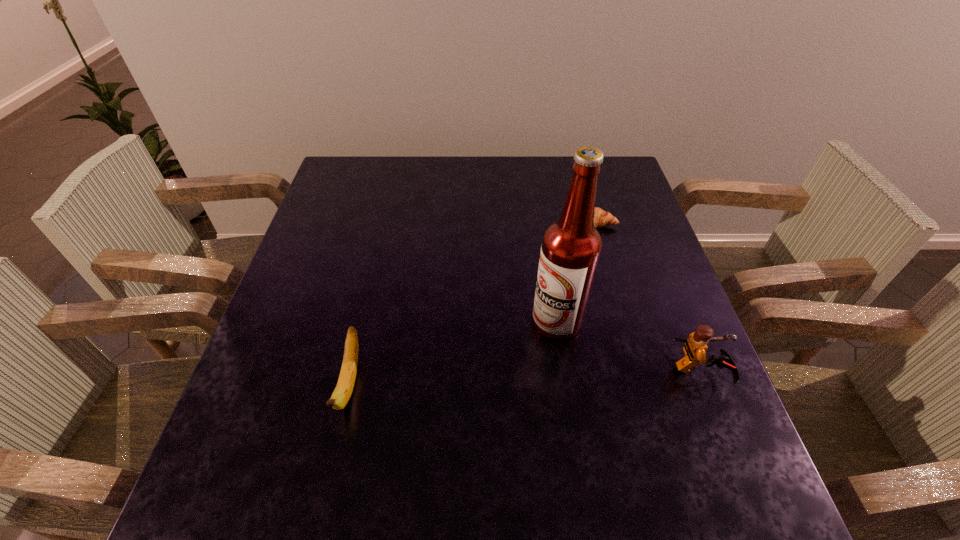
The width and height of the screenshot is (960, 540). I want to click on free space that satisfies the following two spatial constraints: 1. on the front side of the third nearest object; 2. holding a crossbow in the hands of the rightmost object, so click(x=564, y=369).

Locate an element on the screen. The height and width of the screenshot is (540, 960). vacant space that satisfies the following two spatial constraints: 1. on the front side of the third shortest object; 2. holding a crossbow in the hands of the shortest object is located at coordinates (637, 369).